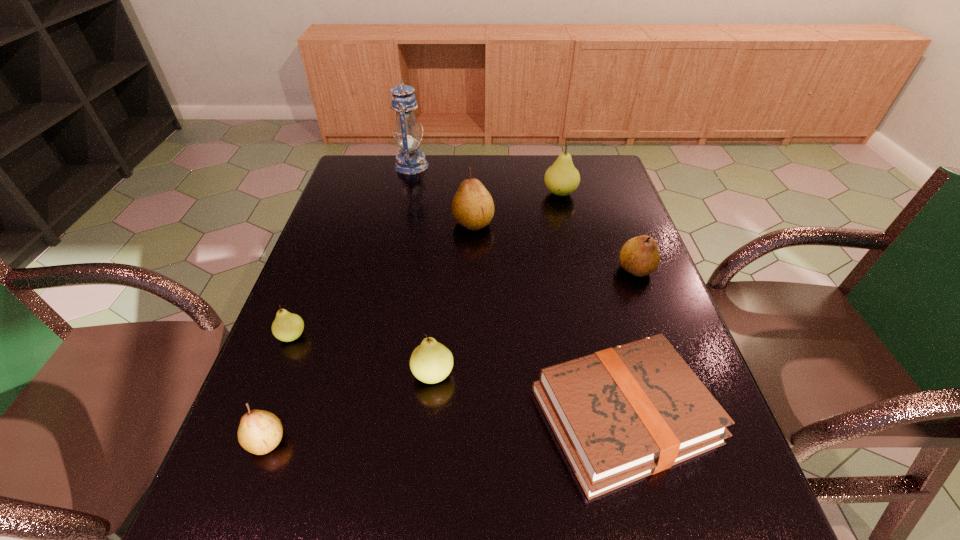
Image resolution: width=960 pixels, height=540 pixels. What are the coordinates of `free region located on the right of the fourth nearest object` in the screenshot? It's located at (399, 336).

Where is `vacant space located on the back of the nearest brown pear`? Image resolution: width=960 pixels, height=540 pixels. vacant space located on the back of the nearest brown pear is located at coordinates (309, 323).

Identify the location of vacant space located on the back of the shortest object. The height and width of the screenshot is (540, 960). (591, 288).

At what (x,y) coordinates should I click in order to perform the action: click on lantern present at the far edge. Please return your answer as a coordinate pair (x, y). This screenshot has height=540, width=960. Looking at the image, I should click on (410, 161).

Image resolution: width=960 pixels, height=540 pixels. I want to click on pear present at the far edge, so click(x=562, y=178).

This screenshot has width=960, height=540. Find the location of `lantern that is at the left edge`. lantern that is at the left edge is located at coordinates click(x=410, y=161).

At what (x,y) coordinates should I click in order to perform the action: click on hardback book that is positioned at the right edge. Please return your answer as a coordinate pair (x, y). Looking at the image, I should click on (621, 414).

Where is `object situated at the far left corner`? The width and height of the screenshot is (960, 540). object situated at the far left corner is located at coordinates (410, 161).

Locate an element on the screen. The height and width of the screenshot is (540, 960). object present at the far right corner is located at coordinates (562, 178).

The image size is (960, 540). In order to click on vacant space at the far edge in this screenshot , I will do `click(424, 186)`.